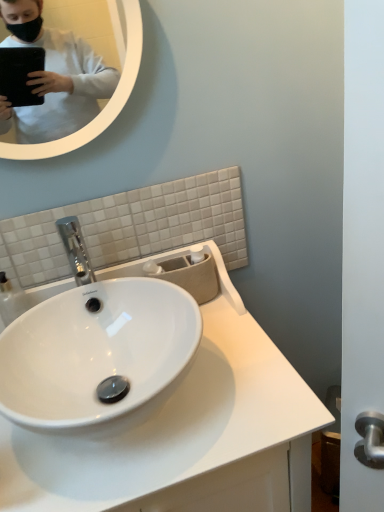
This screenshot has height=512, width=384. I want to click on white glossy mirror at upper left, so click(67, 76).

This screenshot has height=512, width=384. What do you see at coordinates (67, 76) in the screenshot? I see `white glossy mirror at upper left` at bounding box center [67, 76].

What do you see at coordinates (186, 435) in the screenshot? I see `white glossy sink at center` at bounding box center [186, 435].

Identify the location of white glossy sink at center. The width and height of the screenshot is (384, 512). (186, 435).

This screenshot has height=512, width=384. Identify the location of white glossy mirror at upper left. coord(67,76).

Is white glossy mirror at upper left to the left of white glossy sink at center from the viewer's perspective?

Yes.

Considering the relative positions of white glossy mirror at upper left and white glossy sink at center in the image provided, is white glossy mirror at upper left behind white glossy sink at center?

Yes, the depth of white glossy mirror at upper left is greater than that of white glossy sink at center.

Which is less distant, (x=33, y=135) or (x=211, y=333)?

Point (x=33, y=135) is positioned farther from the camera compared to point (x=211, y=333).

From the image's perspective, is white glossy mirror at upper left located above or below white glossy sink at center?

From the image's perspective, white glossy mirror at upper left appears above white glossy sink at center.

Looking at this image, from a real-world perspective, is white glossy mirror at upper left located beneath white glossy sink at center?

No, from a real-world perspective, white glossy mirror at upper left is not under white glossy sink at center.

Is white glossy mirror at upper left wider or thinner than white glossy sink at center?

In the image, white glossy mirror at upper left appears to be more narrow than white glossy sink at center.

Can you confirm if white glossy mirror at upper left is taller than white glossy sink at center?

In fact, white glossy mirror at upper left may be shorter than white glossy sink at center.

Is white glossy mirror at upper left bigger than white glossy sink at center?

Actually, white glossy mirror at upper left might be smaller than white glossy sink at center.

Is white glossy sink at center a part of white glossy mirror at upper left?

No, white glossy sink at center is located outside of white glossy mirror at upper left.

Are white glossy mirror at upper left and white glossy sink at center beside each other?

They are not placed beside each other.

Could you tell me if white glossy mirror at upper left is facing white glossy sink at center?

No, white glossy mirror at upper left is not facing towards white glossy sink at center.

In order to click on mirror behind the white glossy sink at center in this screenshot , I will do `click(67, 76)`.

Does white glossy sink at center appear on the right side of white glossy mirror at upper left?

Yes.

Which object is further away from the camera, white glossy sink at center or white glossy mirror at upper left?

white glossy mirror at upper left is further from the camera.

Is point (253, 386) positioned after point (107, 57)?

No, it is not.

From the image's perspective, which one is positioned lower, white glossy sink at center or white glossy mirror at upper left?

white glossy sink at center appears lower in the image.

From a real-world perspective, is white glossy sink at center positioned above or below white glossy mirror at upper left?

Clearly, from a real-world perspective, white glossy sink at center is below white glossy mirror at upper left.

Considering the sizes of white glossy sink at center and white glossy mirror at upper left in the image, is white glossy sink at center wider or thinner than white glossy mirror at upper left?

Clearly, white glossy sink at center has more width compared to white glossy mirror at upper left.

Who is shorter, white glossy sink at center or white glossy mirror at upper left?

white glossy mirror at upper left.

Between white glossy sink at center and white glossy mirror at upper left, which one has smaller size?

Smaller between the two is white glossy mirror at upper left.

Is white glossy sink at center situated inside white glossy mirror at upper left or outside?

The correct answer is: outside.

Is the surface of white glossy sink at center in direct contact with white glossy mirror at upper left?

No.

Could you tell me if white glossy sink at center is turned towards white glossy mirror at upper left?

No, white glossy sink at center is not facing towards white glossy mirror at upper left.

How distant is white glossy sink at center from white glossy mirror at upper left?

They are 33.09 inches apart.

The image size is (384, 512). Find the location of `mirror that is on the left side of white glossy sink at center`. mirror that is on the left side of white glossy sink at center is located at coordinates (67, 76).

Identify the location of mirror above the white glossy sink at center (from a real-world perspective). This screenshot has width=384, height=512. (67, 76).

Where is `sink lying on the right of white glossy mirror at upper left`? The width and height of the screenshot is (384, 512). sink lying on the right of white glossy mirror at upper left is located at coordinates (186, 435).